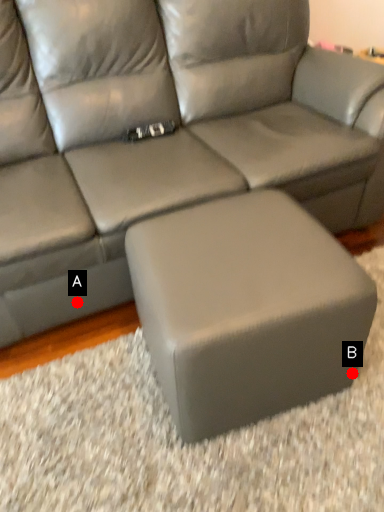
Question: Two points are circled on the image, labeled by A and B beside each circle. Which point is closer to the camera?

Choices:
 (A) A is closer
 (B) B is closer

Answer: (B)